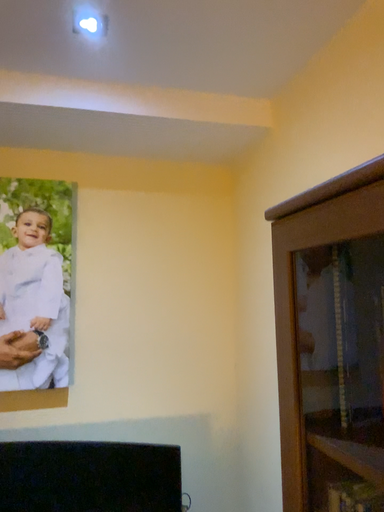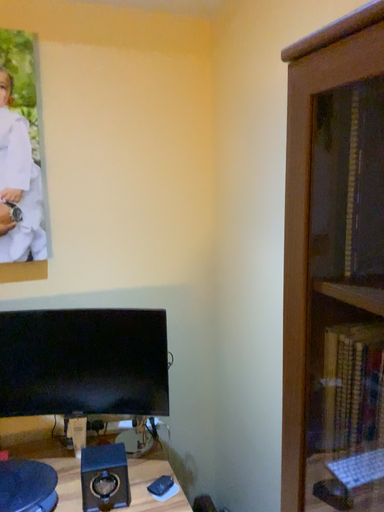
Question: Which way did the camera rotate in the video?

Choices:
 (A) rotated upward
 (B) rotated downward

Answer: (B)